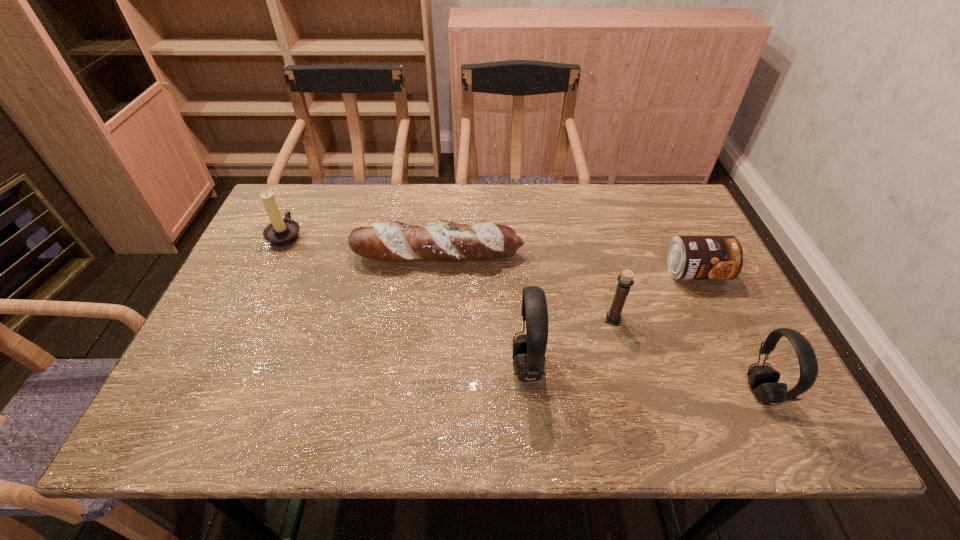
Given the evenly spaced headsets in the image, where should an extra headset be added on the left to preserve the spacing? Please point to a vacant space. Please provide its 2D coordinates. Your answer should be formatted as a tuple, i.e. [(x, y)], where the tuple contains the x and y coordinates of a point satisfying the conditions above.

[(314, 343)]